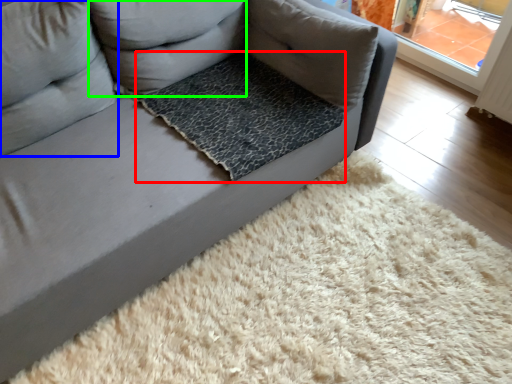
Question: Which object is positioned closest to dog bed (highlighted by a red box)? Select from pillow (highlighted by a blue box) and pillow (highlighted by a green box).

Choices:
 (A) pillow
 (B) pillow

Answer: (B)